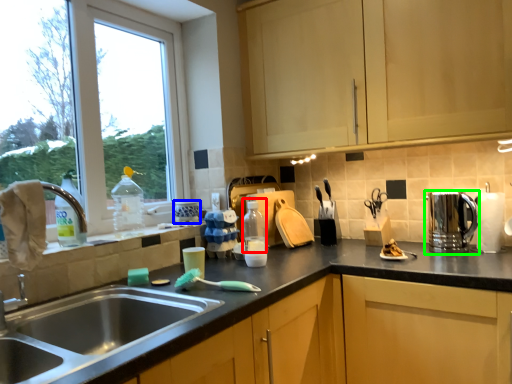
Question: Which object is positioned farthest from bottle (highlighted by a red box)? Select from appliance (highlighted by a blue box) and appliance (highlighted by a green box).

Choices:
 (A) appliance
 (B) appliance

Answer: (B)